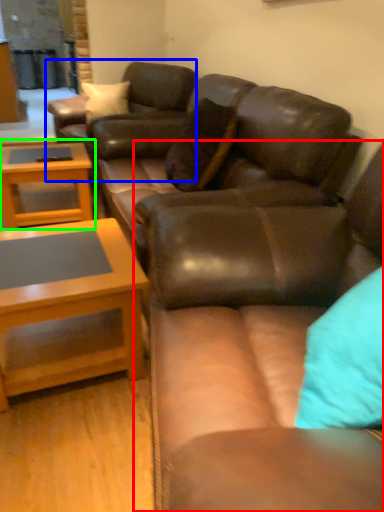
Question: Considering the real-world distances, which object is closest to studio couch (highlighted by a red box)? swivel chair (highlighted by a blue box) or coffee table (highlighted by a green box).

Choices:
 (A) swivel chair
 (B) coffee table

Answer: (B)